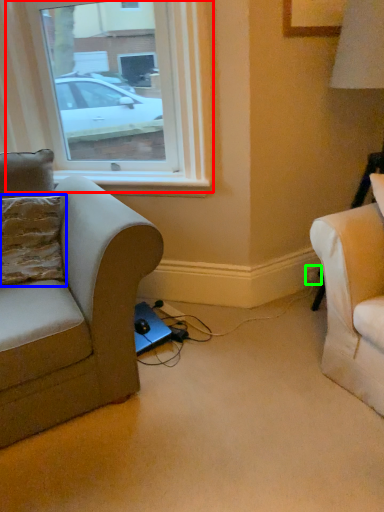
Question: Which is farther away from window (highlighted by a red box)? pillow (highlighted by a blue box) or electric outlet (highlighted by a green box)?

Choices:
 (A) pillow
 (B) electric outlet

Answer: (B)